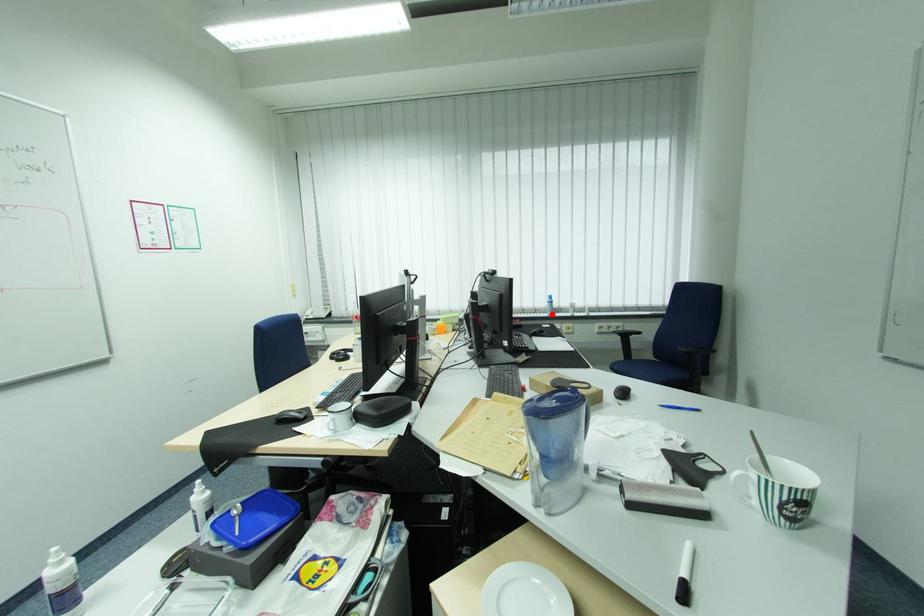
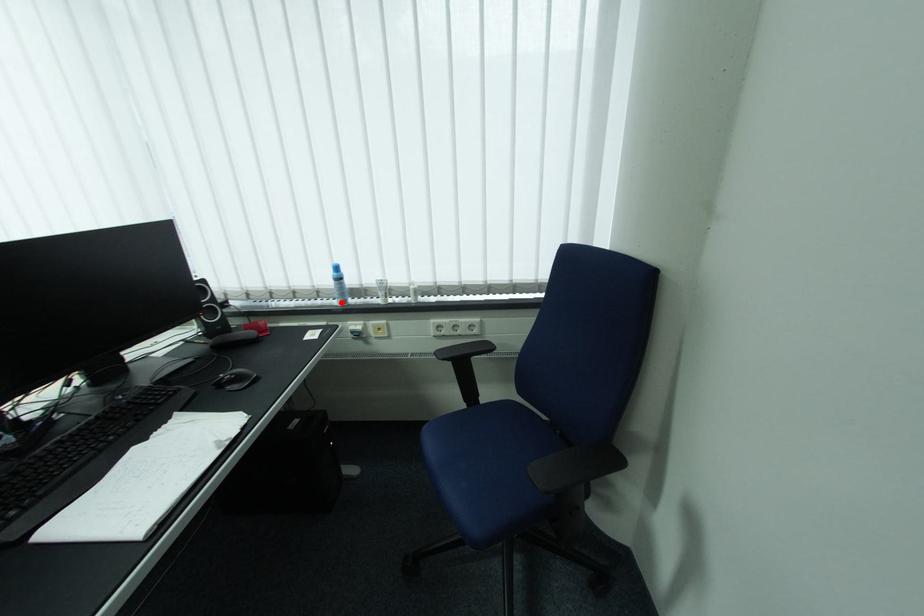
I am providing you with two images of the same scene from different viewpoints. A red point is marked on the first image and another point is marked on the second image. Are the points marked in image1 and image2 representing the same 3D position?

Yes